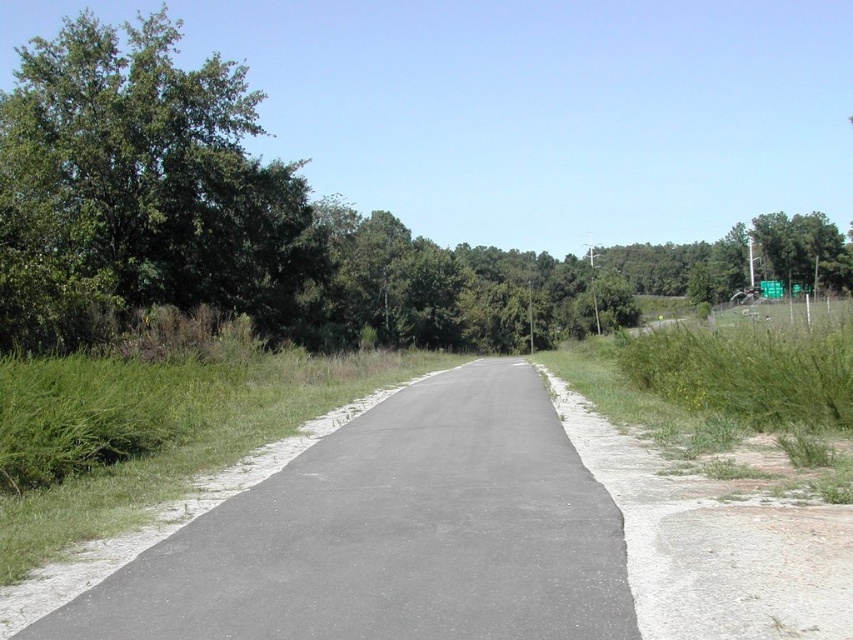
Can you confirm if gray asphalt path at center is shorter than green metallic sign at upper right?

Yes, gray asphalt path at center is shorter than green metallic sign at upper right.

Measure the distance between gray asphalt path at center and green metallic sign at upper right.

100.84 meters

Is point (233, 563) positioned in front of point (761, 282)?

Yes, point (233, 563) is closer to viewer.

Locate an element on the screen. Image resolution: width=853 pixels, height=640 pixels. gray asphalt path at center is located at coordinates click(392, 534).

Is point (141, 580) positioned before point (94, 275)?

Yes, point (141, 580) is in front of point (94, 275).

Can you confirm if gray asphalt path at center is smaller than green leafy tree at left?

Yes, gray asphalt path at center is smaller than green leafy tree at left.

Is point (421, 396) positioned in front of point (90, 189)?

That is True.

Locate an element on the screen. This screenshot has width=853, height=640. gray asphalt path at center is located at coordinates (392, 534).

Is green leafy tree at left taller than green metallic sign at upper right?

Yes, green leafy tree at left is taller than green metallic sign at upper right.

Is green leafy tree at left positioned before green metallic sign at upper right?

Yes.

The width and height of the screenshot is (853, 640). I want to click on green leafy tree at left, so click(140, 188).

This screenshot has width=853, height=640. Identify the location of green leafy tree at left. (140, 188).